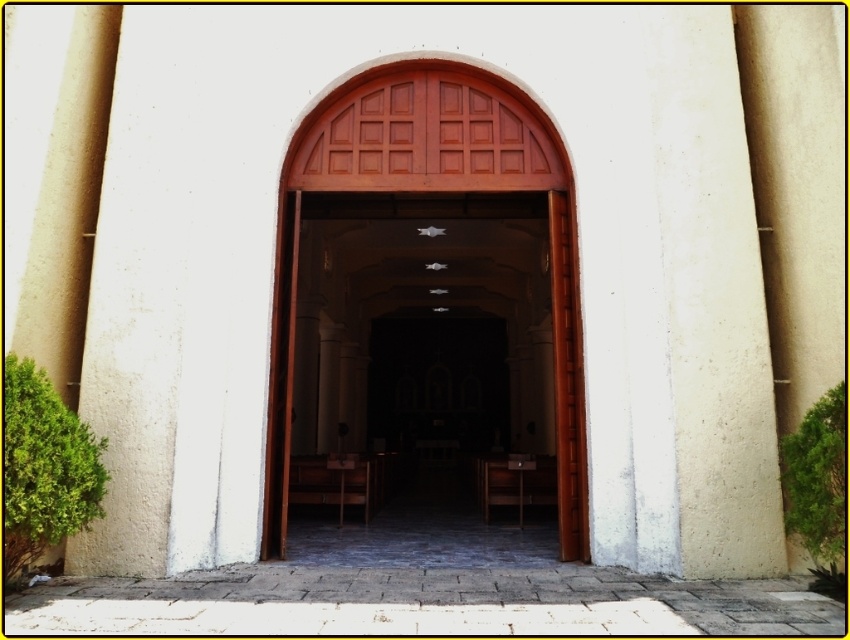
You are standing outside the church entrance and want to place a small potted plant between the smooth beige pillar at right and the brown wooden chair at center. Based on their sizes, which object should the plant be closer to?

The smooth beige pillar at right has a larger size compared to the brown wooden chair at center, so the plant should be placed closer to the brown wooden chair at center to maintain balance between the objects.

You are standing at the entrance of the church and want to take a photo of the point at coordinates point (661, 72). If your camera has a maximum focus range of 5 meters, will it be able to focus on that point?

The distance between point (661, 72) and the camera is 5.74 meters, which exceeds the camera maximum focus range of 5 meters. Therefore, the camera cannot focus on the point.

You are standing at the entrance of the church and want to walk towards the point that is closer to the open door. Which point should you head towards, point (x=332, y=212) or point (x=367, y=480)?

Point (x=332, y=212) is in front of point (x=367, y=480), so you should head towards point (x=332, y=212) as it is closer to the open door.